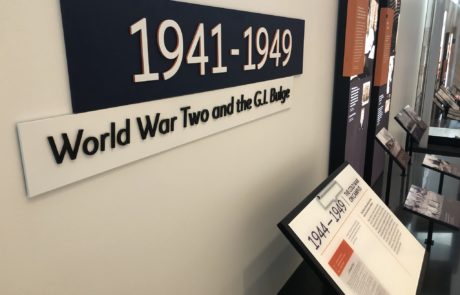
Locate an element on the screen. This screenshot has width=460, height=295. tall vertical white beam between displays, right side is located at coordinates (415, 71).